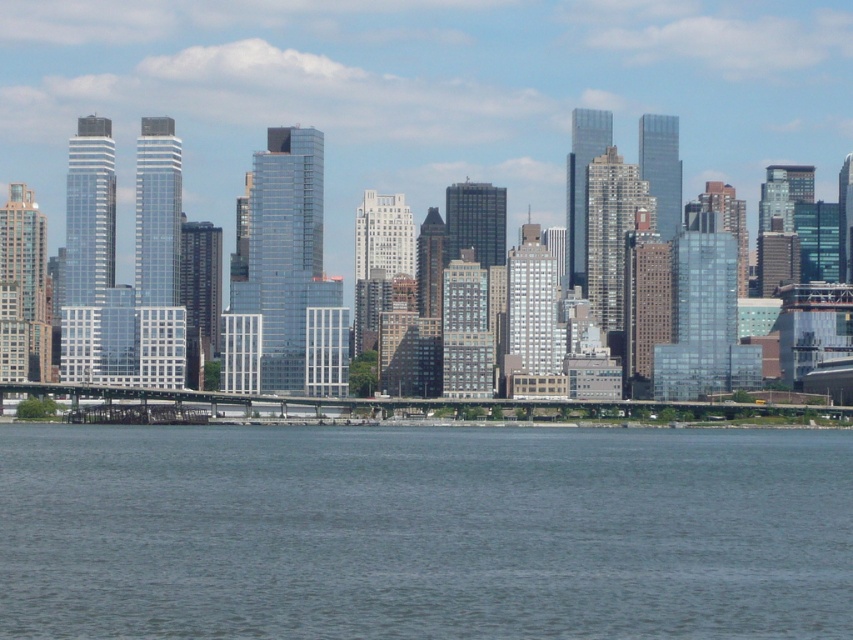
The image size is (853, 640). Describe the element at coordinates (422, 531) in the screenshot. I see `blue water at lower center` at that location.

Measure the distance between point (262, 564) and camera.

Point (262, 564) is 656.53 meters from camera.

Is point (10, 531) behind point (165, 369)?

That is True.

Find the location of a particular element. The image size is (853, 640). blue water at lower center is located at coordinates (422, 531).